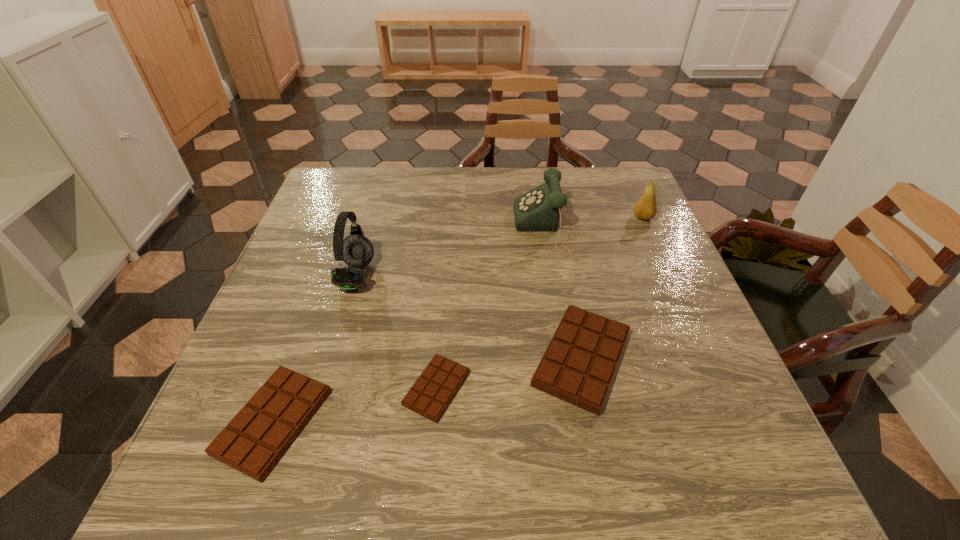
The candy bars are evenly distributed in the image. To maintain this, where would you place another candy bar on the right? Please point to a free space. Please provide its 2D coordinates. Your answer should be formatted as a tuple, i.e. [(x, y)], where the tuple contains the x and y coordinates of a point satisfying the conditions above.

[(711, 332)]